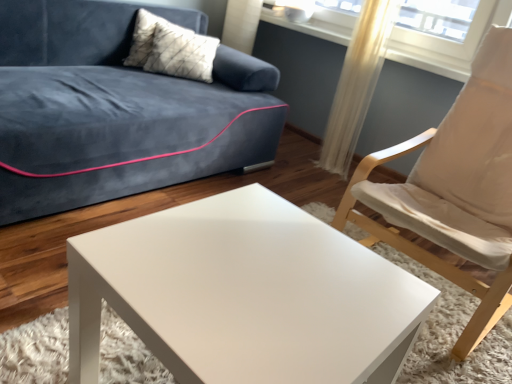
Question: Is white textured pillow at upper left inside the boundaries of white glossy coffee table at center, or outside?

Choices:
 (A) outside
 (B) inside

Answer: (A)

Question: Is point (195, 59) positioned closer to the camera than point (77, 296)?

Choices:
 (A) closer
 (B) farther

Answer: (B)

Question: Estimate the real-world distances between objects in this image. Which object is closer to the white textured pillow at upper left?

Choices:
 (A) translucent fabric curtain at upper right
 (B) white fabric chair at right
 (C) white glossy coffee table at center

Answer: (A)

Question: Which object is the farthest from the white fabric chair at right?

Choices:
 (A) white glossy coffee table at center
 (B) translucent fabric curtain at upper right
 (C) white textured pillow at upper left

Answer: (C)